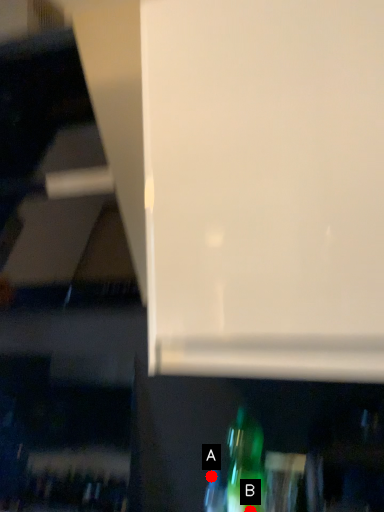
Question: Two points are circled on the image, labeled by A and B beside each circle. Which point is further to the camera?

Choices:
 (A) A is further
 (B) B is further

Answer: (A)